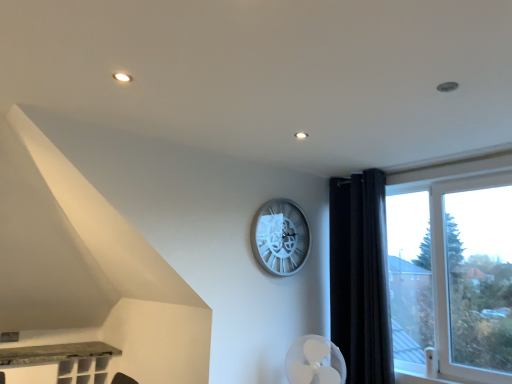
Question: Do you think silver metallic clock at center is within transparent glass window at right, or outside of it?

Choices:
 (A) outside
 (B) inside

Answer: (A)

Question: Looking at their shapes, would you say silver metallic clock at center is wider or thinner than transparent glass window at right?

Choices:
 (A) wide
 (B) thin

Answer: (B)

Question: Estimate the real-world distances between objects in this image. Which object is farther from the transparent glass window at right?

Choices:
 (A) black velvet curtain at right
 (B) silver metallic clock at center

Answer: (B)

Question: Which object is positioned farthest from the transparent glass window at right?

Choices:
 (A) silver metallic clock at center
 (B) black velvet curtain at right

Answer: (A)